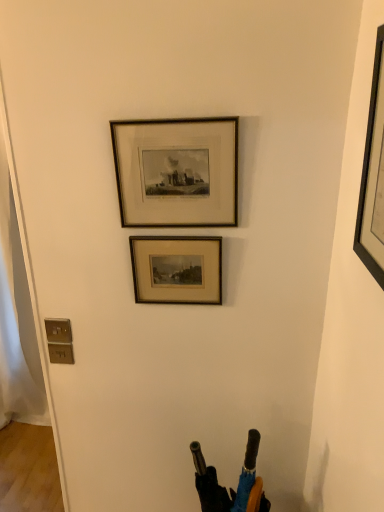
Question: From a real-world perspective, is wooden frame at upper center, marked as the 2th picture frame in a back-to-front arrangement, above or below wooden framed print at center, the first picture frame when ordered from back to front?

Choices:
 (A) below
 (B) above

Answer: (B)

Question: In terms of height, does wooden frame at upper center, marked as the 2th picture frame in a back-to-front arrangement, look taller or shorter compared to wooden framed print at center, the first picture frame when ordered from back to front?

Choices:
 (A) tall
 (B) short

Answer: (A)

Question: Considering the real-world distances, which object is closest to the wooden framed print at center, the first picture frame when ordered from back to front?

Choices:
 (A) wooden frame at upper center, the second picture frame from the front
 (B) black matte picture frame at upper right, which appears as the 1th picture frame when viewed from the front

Answer: (A)

Question: Which object is positioned farthest from the black matte picture frame at upper right, the 3th picture frame when ordered from back to front?

Choices:
 (A) wooden frame at upper center, marked as the 2th picture frame in a back-to-front arrangement
 (B) wooden framed print at center, positioned as the 3th picture frame in front-to-back order

Answer: (B)